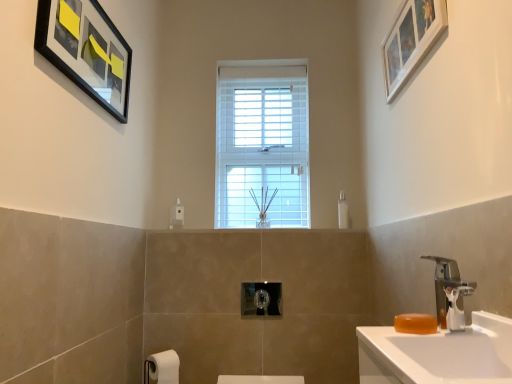
Question: From the image's perspective, is black matte picture frame at upper left, positioned as the second picture frame in right-to-left order, on top of polished chrome towel bar at center?

Choices:
 (A) no
 (B) yes

Answer: (B)

Question: From the image's perspective, would you say black matte picture frame at upper left, positioned as the second picture frame in right-to-left order, is shown under polished chrome towel bar at center?

Choices:
 (A) yes
 (B) no

Answer: (B)

Question: From a real-world perspective, is black matte picture frame at upper left, marked as the 1th picture frame in a left-to-right arrangement, on top of polished chrome towel bar at center?

Choices:
 (A) yes
 (B) no

Answer: (A)

Question: Can polished chrome towel bar at center be found inside black matte picture frame at upper left, marked as the 1th picture frame in a left-to-right arrangement?

Choices:
 (A) yes
 (B) no

Answer: (B)

Question: Can you confirm if black matte picture frame at upper left, marked as the 1th picture frame in a left-to-right arrangement, is bigger than polished chrome towel bar at center?

Choices:
 (A) no
 (B) yes

Answer: (B)

Question: Considering the positions of point (288, 155) and point (343, 215), is point (288, 155) closer or farther from the camera than point (343, 215)?

Choices:
 (A) farther
 (B) closer

Answer: (A)

Question: Is white wooden window at center to the left or to the right of transparent plastic soap dispenser at center-right in the image?

Choices:
 (A) left
 (B) right

Answer: (A)

Question: From a real-world perspective, is white wooden window at center above or below transparent plastic soap dispenser at center-right?

Choices:
 (A) below
 (B) above

Answer: (B)

Question: Looking at their shapes, would you say white wooden window at center is wider or thinner than transparent plastic soap dispenser at center-right?

Choices:
 (A) thin
 (B) wide

Answer: (B)

Question: In the image, is transparent plastic soap dispenser at center-right positioned in front of or behind polished chrome towel bar at center?

Choices:
 (A) front
 (B) behind

Answer: (B)

Question: Is transparent plastic soap dispenser at center-right bigger or smaller than polished chrome towel bar at center?

Choices:
 (A) small
 (B) big

Answer: (A)

Question: In terms of height, does transparent plastic soap dispenser at center-right look taller or shorter compared to polished chrome towel bar at center?

Choices:
 (A) tall
 (B) short

Answer: (A)

Question: Which is correct: transparent plastic soap dispenser at center-right is inside polished chrome towel bar at center, or outside of it?

Choices:
 (A) inside
 (B) outside

Answer: (B)

Question: From the image's perspective, is silver metallic faucet at right above or below white wooden picture frame at upper right, marked as the second picture frame in a left-to-right arrangement?

Choices:
 (A) below
 (B) above

Answer: (A)

Question: In terms of height, does silver metallic faucet at right look taller or shorter compared to white wooden picture frame at upper right, marked as the second picture frame in a left-to-right arrangement?

Choices:
 (A) short
 (B) tall

Answer: (A)